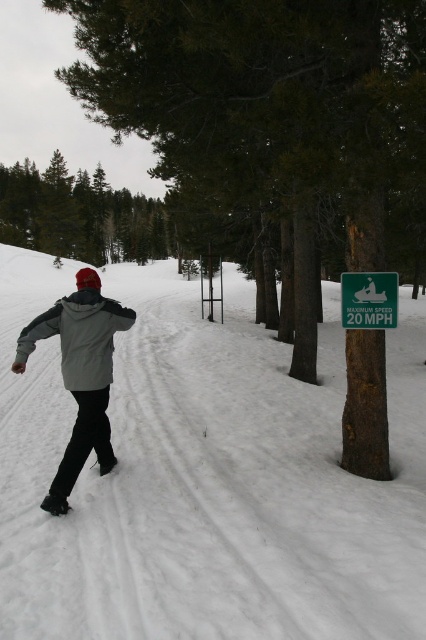
You are an observer in the snowy forest scene. You notice the brown rough tree at center and the gray fleece jacket at center. Which object appears bigger in the image?

The brown rough tree at center appears bigger than the gray fleece jacket at center in the image.

You are navigating through a snowy forest and see two points marked on your map. The first point is at coordinate point [138,243] and the second point is at coordinate point [71,385]. According to the scene, which point is closer to your current position?

Point [71,385] is closer to your current position because it is in front of point [138,243] as per the scene description.

You are standing in the snowy forest and see the green matte tree at upper center and the gray matte jacket at center. Which object appears bigger in the image?

The green matte tree at upper center is larger in size than the gray matte jacket at center, so it appears bigger in the image.